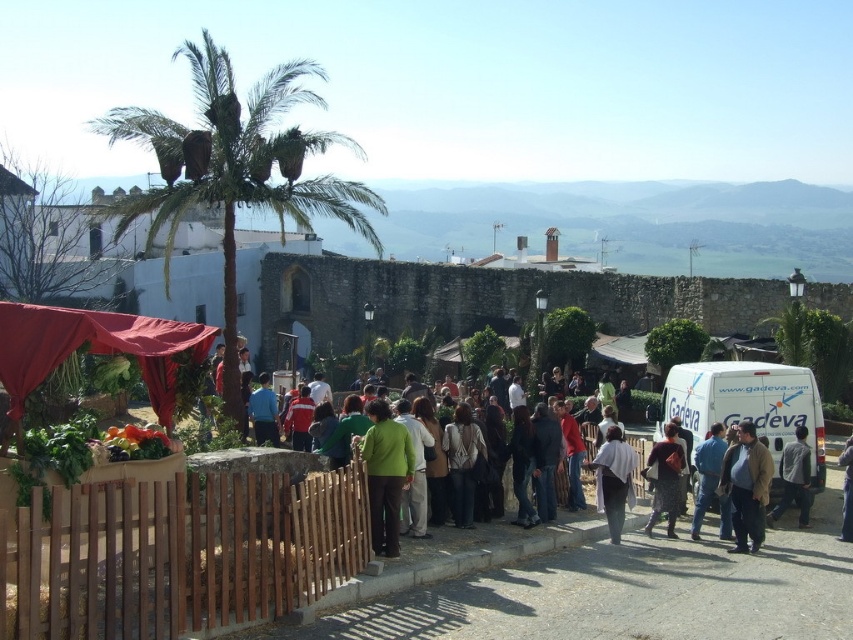
Who is lower down, green leafy palm at center or white matte van at center-right?

Positioned lower is white matte van at center-right.

Is green leafy palm at center positioned in front of white matte van at center-right?

That is True.

You are a GUI agent. You are given a task and a screenshot of the screen. Output one action in this format:
    pyautogui.click(x=<x>, y=<y>)
    Task: Click on the green leafy palm at center
    The width and height of the screenshot is (853, 640).
    Given the screenshot: What is the action you would take?
    pyautogui.click(x=235, y=168)

Locate an element on the screen. This screenshot has height=640, width=853. green leafy palm at center is located at coordinates (235, 168).

Which of these two, brown wooden fence at lower left or blue fabric shirt at center, stands taller?

With more height is brown wooden fence at lower left.

Looking at this image, who is more distant from viewer, (335,480) or (265,424)?

The point (265,424) is behind.

Find the location of a particular element. brown wooden fence at lower left is located at coordinates (177, 552).

Based on the photo, can you confirm if dark gray sweater at center is thinner than blue denim jeans at center?

Correct, dark gray sweater at center's width is less than blue denim jeans at center's.

The height and width of the screenshot is (640, 853). Identify the location of dark gray sweater at center. (463, 461).